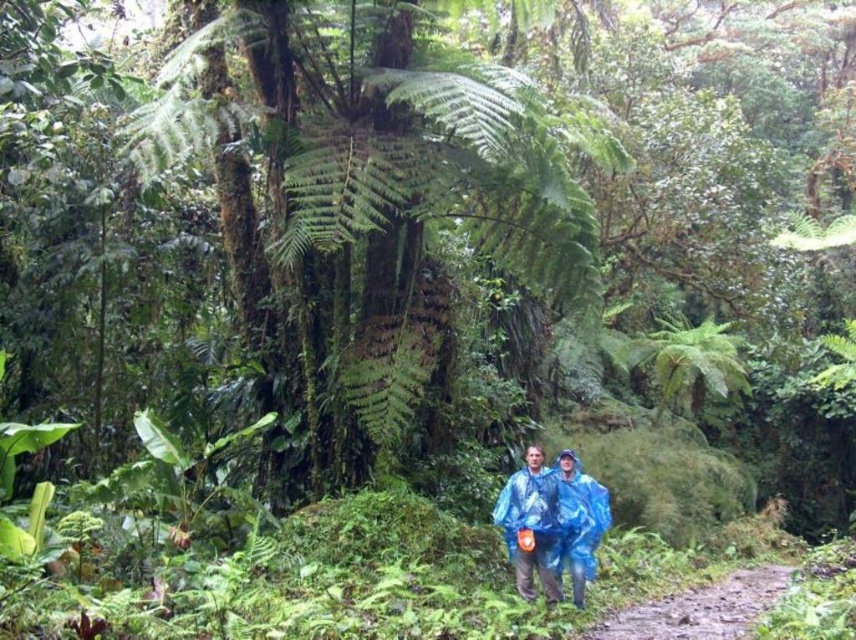
Question: Which point is closer to the camera taking this photo?

Choices:
 (A) pyautogui.click(x=663, y=621)
 (B) pyautogui.click(x=542, y=484)

Answer: (A)

Question: Where is blue waterproof poncho at center located in relation to green leafy fern at upper right in the image?

Choices:
 (A) left
 (B) right

Answer: (A)

Question: Which point appears closest to the camera in this image?

Choices:
 (A) tap(675, 394)
 (B) tap(678, 632)

Answer: (B)

Question: Does blue waterproof poncho at center have a lesser width compared to green leafy fern at upper right?

Choices:
 (A) no
 (B) yes

Answer: (B)

Question: Considering the real-world distances, which object is farthest from the green leafy fern at upper right?

Choices:
 (A) dirt path at lower center
 (B) blue waterproof poncho at center

Answer: (A)

Question: Is dirt path at lower center smaller than green leafy fern at upper right?

Choices:
 (A) yes
 (B) no

Answer: (A)